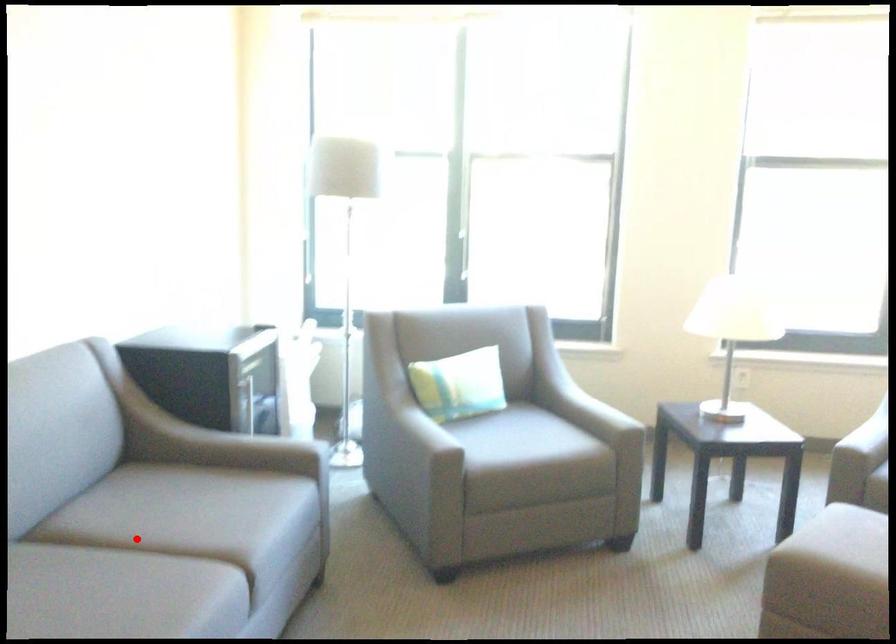
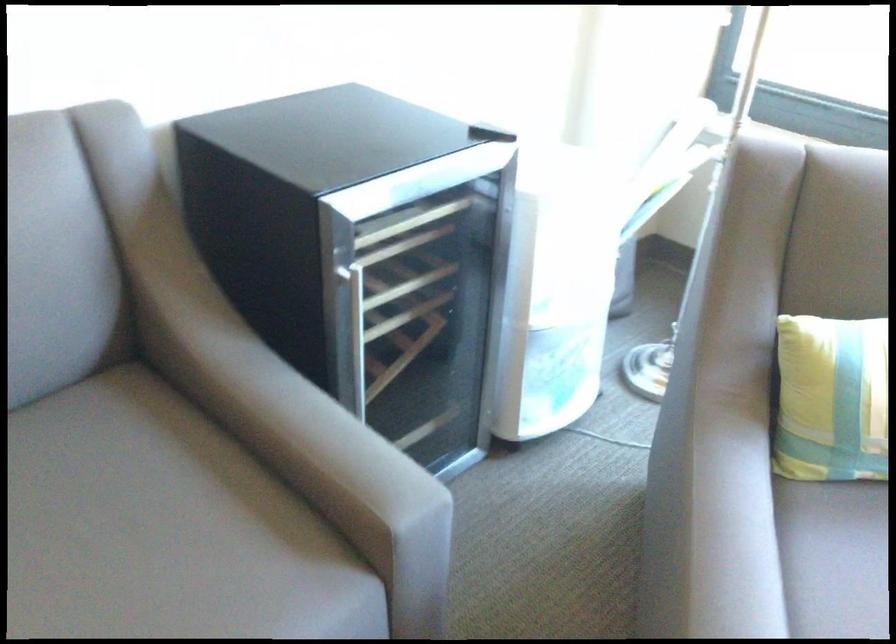
Question: I am providing you with two images of the same scene from different viewpoints. A red point is shown in image1. For the corresponding object point in image2, is it positioned nearer or farther from the camera?

Choices:
 (A) Nearer
 (B) Farther

Answer: (A)